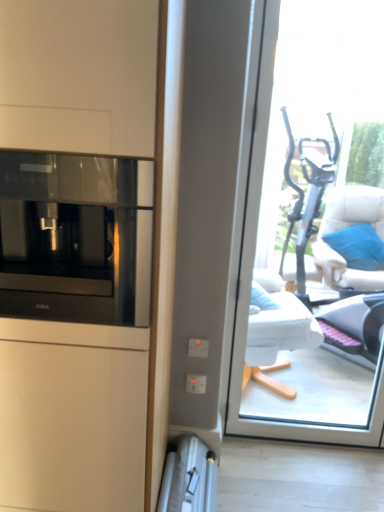
Question: From a real-world perspective, relative to white fabric chair at right, is silver metallic ladder at lower center vertically above or below?

Choices:
 (A) below
 (B) above

Answer: (A)

Question: Relative to white fabric chair at right, is silver metallic ladder at lower center in front or behind?

Choices:
 (A) behind
 (B) front

Answer: (B)

Question: Which of these objects is positioned farthest from the white fabric chair at right?

Choices:
 (A) silver metallic ladder at lower center
 (B) transparent glass window at center
 (C) black glass microwave at left

Answer: (C)

Question: Which object is the farthest from the silver metallic ladder at lower center?

Choices:
 (A) black glass microwave at left
 (B) white fabric chair at right
 (C) transparent glass window at center

Answer: (B)